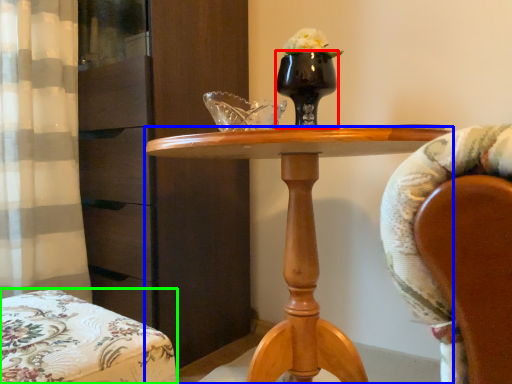
Question: Which is nearer to the vase (highlighted by a red box)? desk (highlighted by a blue box) or chair (highlighted by a green box).

Choices:
 (A) desk
 (B) chair

Answer: (A)